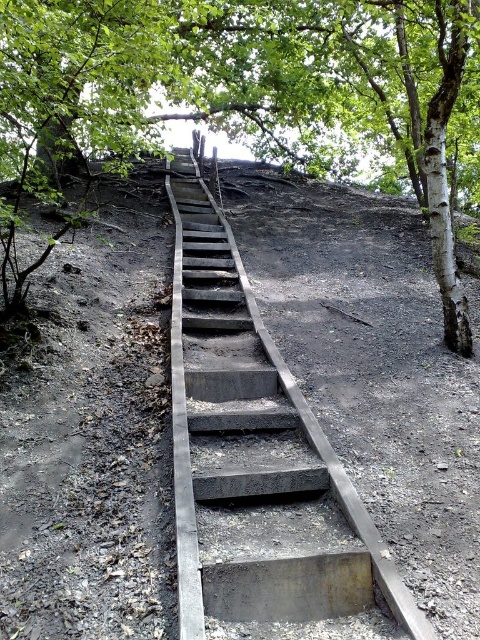
Question: In this image, where is green leafy tree at upper center located relative to concrete/steps at center?

Choices:
 (A) right
 (B) left

Answer: (B)

Question: Which point is farther from the camera taking this photo?

Choices:
 (A) (415, 42)
 (B) (327, 464)

Answer: (A)

Question: Is green leafy tree at upper center bigger than concrete/steps at center?

Choices:
 (A) yes
 (B) no

Answer: (A)

Question: Can you confirm if green leafy tree at upper center is wider than concrete/steps at center?

Choices:
 (A) no
 (B) yes

Answer: (B)

Question: Which object is farther from the camera taking this photo?

Choices:
 (A) concrete/steps at center
 (B) green leafy tree at upper center

Answer: (B)